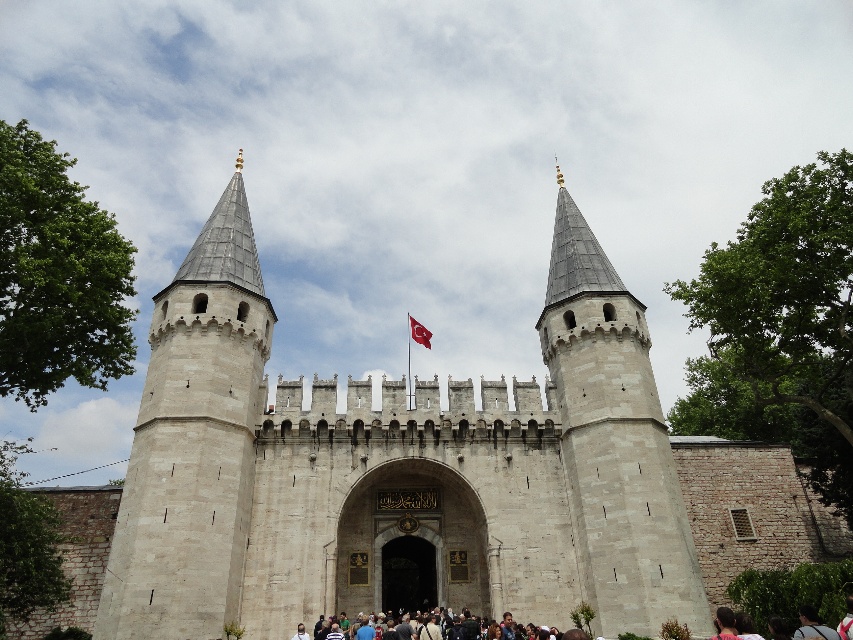
Question: Which object is farther from the camera taking this photo?

Choices:
 (A) dark stone archway at center
 (B) white stone castle at center

Answer: (A)

Question: Does white stone tower at left lie in front of dark brown textured crowd at center?

Choices:
 (A) yes
 (B) no

Answer: (B)

Question: Does white stone tower at left have a smaller size compared to red fabric flag at center?

Choices:
 (A) no
 (B) yes

Answer: (A)

Question: Which of the following is the closest to the observer?

Choices:
 (A) red fabric flag at center
 (B) light gray stone tower at center
 (C) white stone tower at left

Answer: (C)

Question: Which point is closer to the camera taking this photo?

Choices:
 (A) (177, 404)
 (B) (717, 634)
 (C) (424, 339)
 (D) (590, 612)

Answer: (D)

Question: Can you confirm if white stone castle at center is smaller than dark stone archway at center?

Choices:
 (A) yes
 (B) no

Answer: (B)